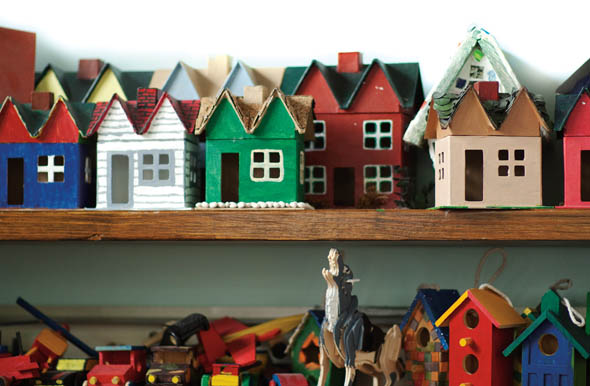
Image resolution: width=590 pixels, height=386 pixels. I want to click on chimney, so click(150, 92), click(47, 99), click(83, 71), click(353, 65), click(249, 98), click(225, 65).